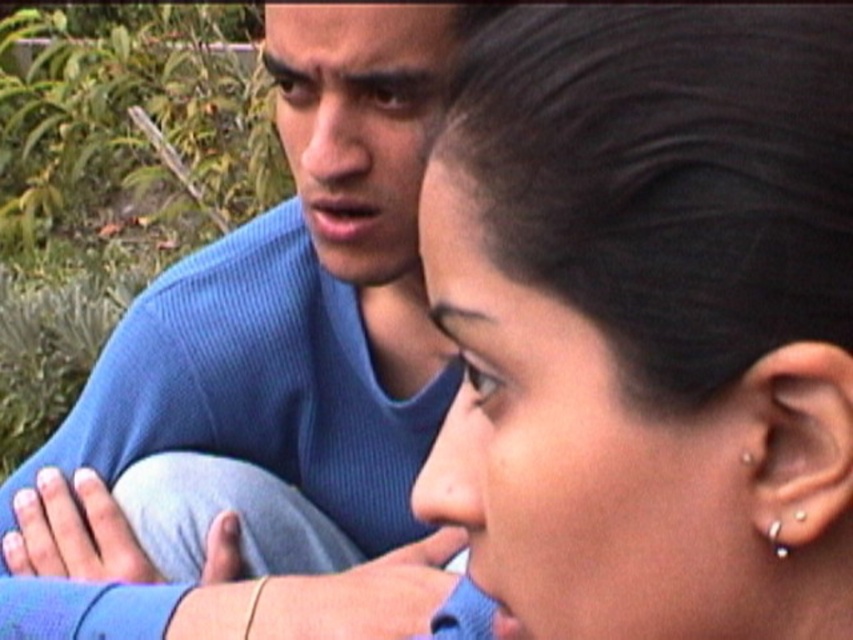
You are standing at the center of the image and want to place a small flower pot exactly at point (268, 410). The blue ribbed sweater at upper left is already there. Can you place the flower pot there?

The point (268, 410) is already occupied by the blue ribbed sweater at upper left, so you cannot place the flower pot there.

Based on the scene description, which object is positioned lower between the black hair at upper center and the matte blue forehead at upper center?

The black hair at upper center is positioned lower than the matte blue forehead at upper center according to the description.